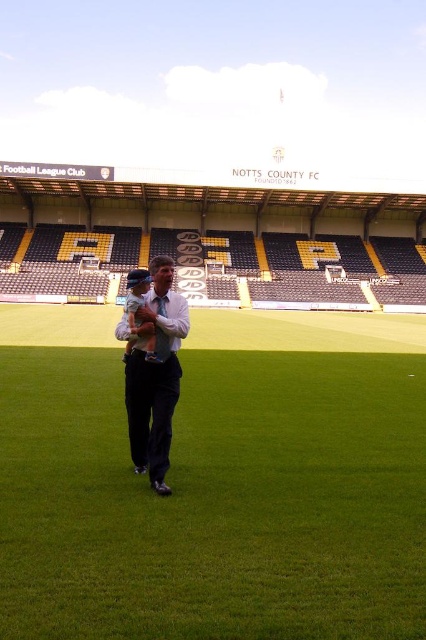
Question: In this image, where is green artificial turf at center located relative to white shirt at center?

Choices:
 (A) above
 (B) below

Answer: (A)

Question: Among these objects, which one is farthest from the camera?

Choices:
 (A) white shirt at center
 (B) green artificial turf at center

Answer: (A)

Question: Which object is positioned closest to the white shirt at center?

Choices:
 (A) light blue fabric baby at center
 (B) green artificial turf at center

Answer: (A)

Question: Is green artificial turf at center closer to the viewer compared to white shirt at center?

Choices:
 (A) yes
 (B) no

Answer: (A)

Question: Which object is farther from the camera taking this photo?

Choices:
 (A) light blue fabric baby at center
 (B) white shirt at center

Answer: (A)

Question: Can you confirm if green artificial turf at center is wider than white shirt at center?

Choices:
 (A) no
 (B) yes

Answer: (B)